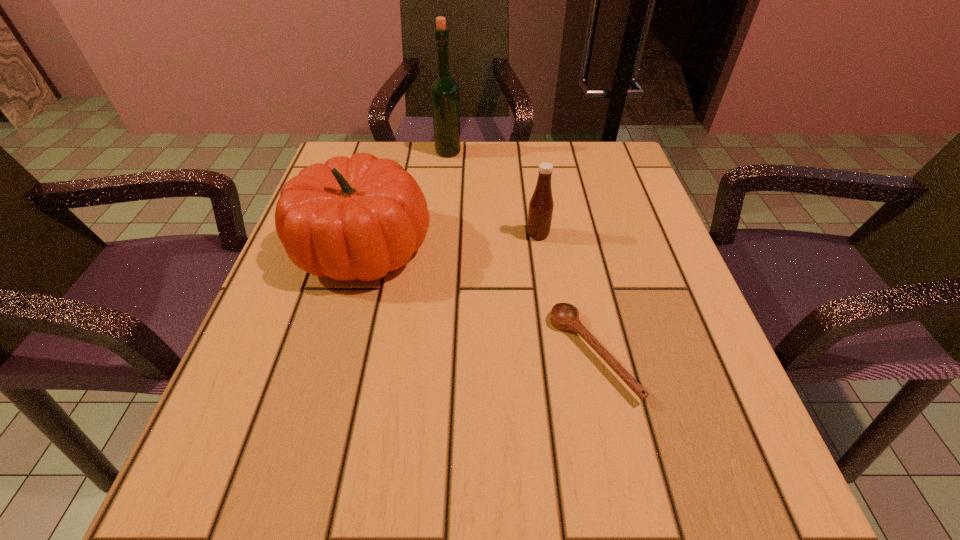
You are a GUI agent. You are given a task and a screenshot of the screen. Output one action in this format:
    pyautogui.click(x=<x>, y=<y>)
    Task: Click on the free spot that satisfies the following two spatial constraints: 1. on the back side of the liquor; 2. on the right side of the pumpkin
    
    Given the screenshot: What is the action you would take?
    pyautogui.click(x=390, y=152)

Image resolution: width=960 pixels, height=540 pixels. In order to click on free space that satisfies the following two spatial constraints: 1. on the front side of the wooden spoon; 2. on the right side of the liquor in this screenshot , I will do `click(429, 354)`.